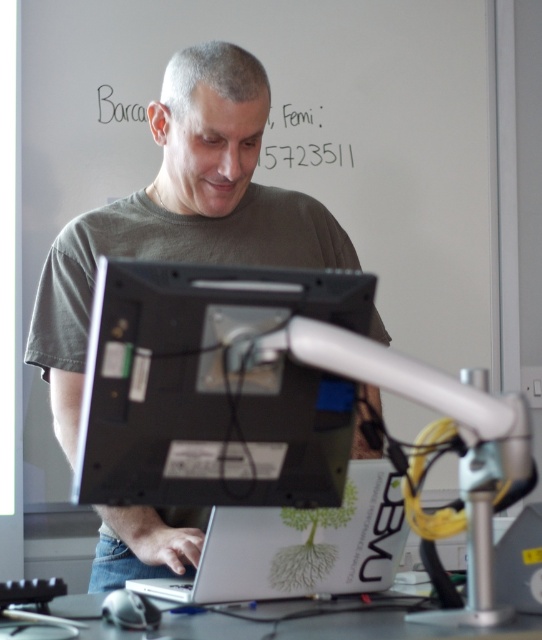
You are a delivery person who just entered the office and see the silver metallic laptop at center and the black paper at upper center. Which object is closer to the front of the desk?

The silver metallic laptop at center is positioned under the black paper at upper center, meaning the black paper at upper center is closer to the front of the desk.

Looking at this image, you are standing in front of the desk and want to reach both points on the desk. Which point, point (191, 56) or point (54, 609), is closer to you?

Point (191, 56) is further to the camera than point (54, 609), so the closer point to you is point (54, 609).